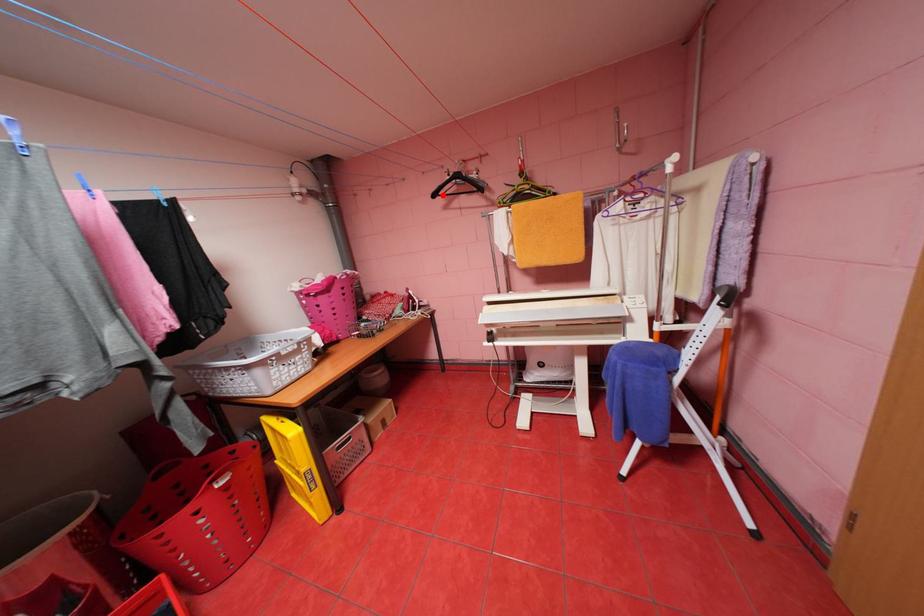
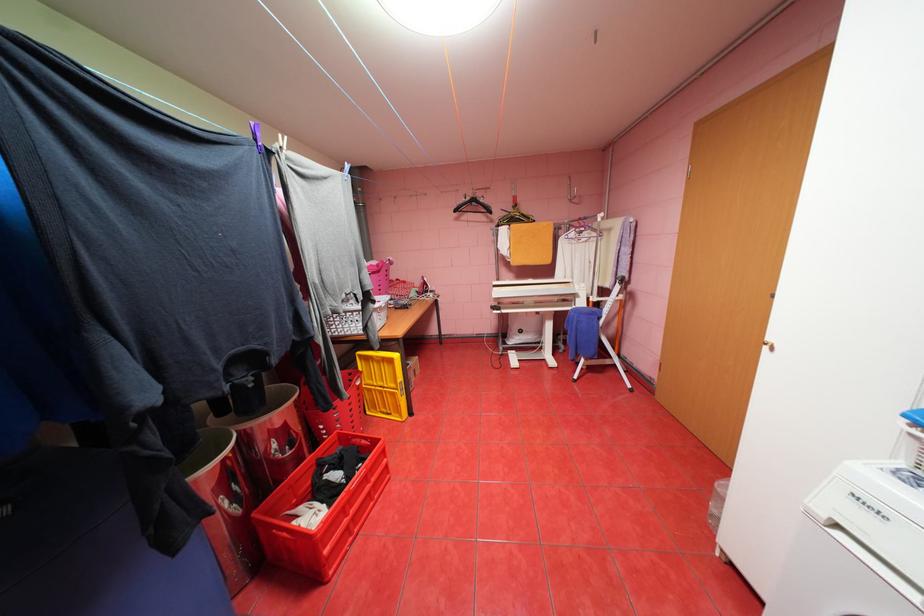
Where in the second image is the point corresponding to the highlighted location from the first image?

(464, 209)